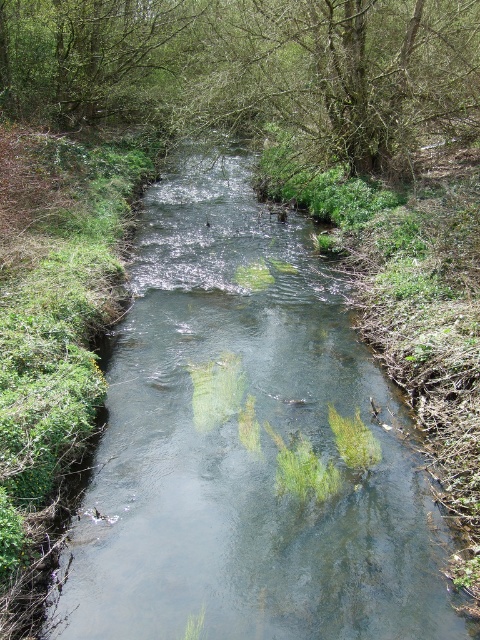
You are a GUI agent. You are given a task and a screenshot of the screen. Output one action in this format:
    pyautogui.click(x=<x>, y=<y>)
    Task: Click on the green leafy tree at center
    This screenshot has width=480, height=640.
    Given the screenshot: What is the action you would take?
    pyautogui.click(x=251, y=68)

At what (x,y) coordinates should I click in order to perform the action: click on green leafy tree at center. Please return your answer as a coordinate pair (x, y). The height and width of the screenshot is (640, 480). Looking at the image, I should click on (251, 68).

Can you confirm if clear water stream at center is bigger than green leafy tree at upper left?

Incorrect, clear water stream at center is not larger than green leafy tree at upper left.

You are a GUI agent. You are given a task and a screenshot of the screen. Output one action in this format:
    pyautogui.click(x=<x>, y=<y>)
    Task: Click on the clear water stream at center
    This screenshot has height=640, width=480.
    Given the screenshot: What is the action you would take?
    pyautogui.click(x=248, y=445)

Does clear water stream at center appear on the left side of green leafy tree at center?

Incorrect, clear water stream at center is not on the left side of green leafy tree at center.

Describe the element at coordinates (248, 445) in the screenshot. I see `clear water stream at center` at that location.

Where is `clear water stream at center`? clear water stream at center is located at coordinates (248, 445).